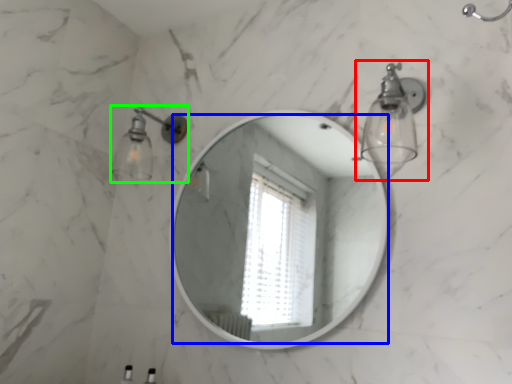
Question: Which is nearer to the light fixture (highlighted by a red box)? mirror (highlighted by a blue box) or light fixture (highlighted by a green box).

Choices:
 (A) mirror
 (B) light fixture

Answer: (B)